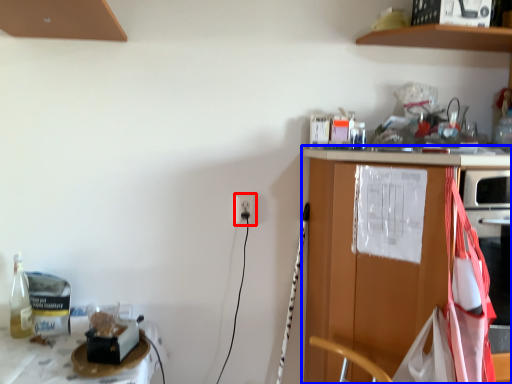
Question: Among these objects, which one is farthest to the camera, electric outlet (highlighted by a red box) or countertop (highlighted by a blue box)?

Choices:
 (A) electric outlet
 (B) countertop

Answer: (A)